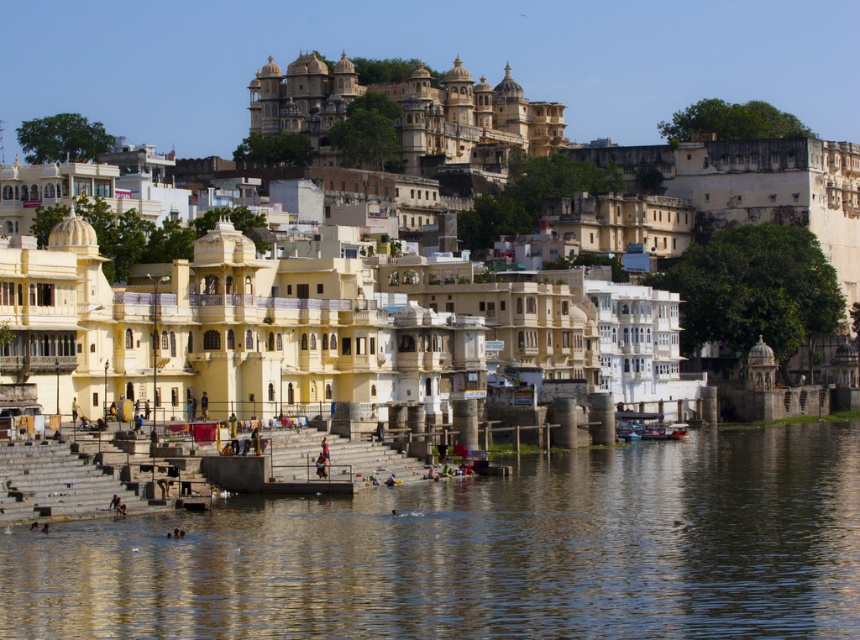
You are a tourist standing on the riverside path and want to take a photo of the brown water at lower center and the matte yellow building at center. Which one will appear larger in your photo?

The brown water at lower center will appear larger in the photo because it is closer to the viewer than the matte yellow building at center.

You are planning to build a small boat dock on the riverside. The dock needs to be as wide as the matte yellow building at center. Can the brown water at lower center accommodate the dock in terms of width?

The brown water at lower center has a width less than the matte yellow building at center, so the dock cannot be accommodated as it would be wider than the available water area.

You are standing on the riverside path and notice the brown water at lower center and the matte yellow building at center. Which object is positioned more to the east if the river flows from west to east?

The brown water at lower center is to the right of the matte yellow building at center. Since the river flows from west to east, the right side would correspond to the east direction. Therefore, the brown water at lower center is positioned more to the east than the matte yellow building at center.